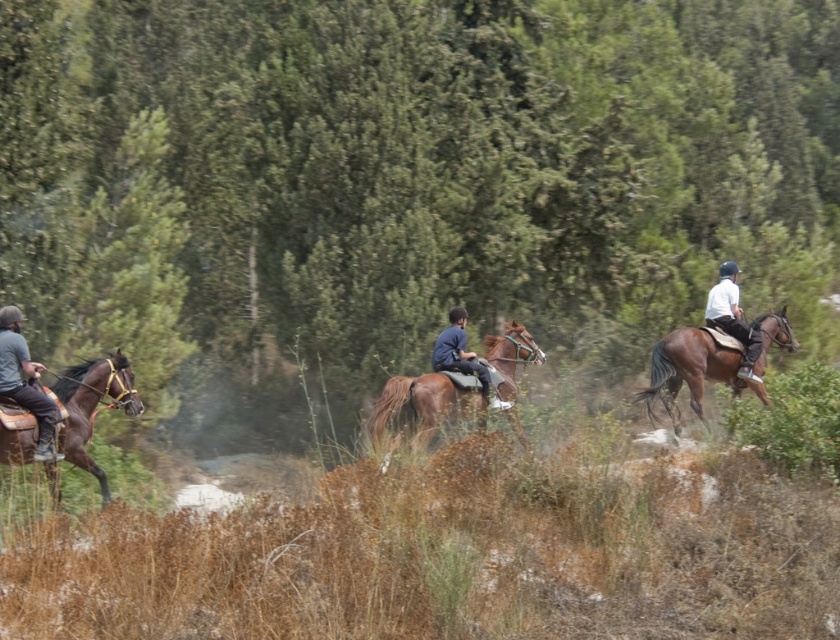
The height and width of the screenshot is (640, 840). Identify the location of brown glossy horse at center. [421, 408].

Is brown glossy horse at center positioned at the back of dark gray fabric jacket at left?

No, it is in front of dark gray fabric jacket at left.

Which is behind, point (436, 422) or point (17, 371)?

Point (436, 422)

In order to click on brown glossy horse at center in this screenshot , I will do (x=421, y=408).

Who is positioned more to the left, green leafy tree at center or brown glossy horse at left?

Positioned to the left is brown glossy horse at left.

Does green leafy tree at center have a greater height compared to brown glossy horse at left?

Yes, green leafy tree at center is taller than brown glossy horse at left.

In order to click on green leafy tree at center in this screenshot , I will do `click(408, 173)`.

Is green leafy tree at center to the right of dark gray fabric jacket at left from the viewer's perspective?

Yes, green leafy tree at center is to the right of dark gray fabric jacket at left.

Between green leafy tree at center and dark gray fabric jacket at left, which one has more height?

Standing taller between the two is green leafy tree at center.

Does point (39, 76) come farther from viewer compared to point (8, 394)?

Yes.

At what (x,y) coordinates should I click in order to perform the action: click on green leafy tree at center. Please return your answer as a coordinate pair (x, y). Looking at the image, I should click on (408, 173).